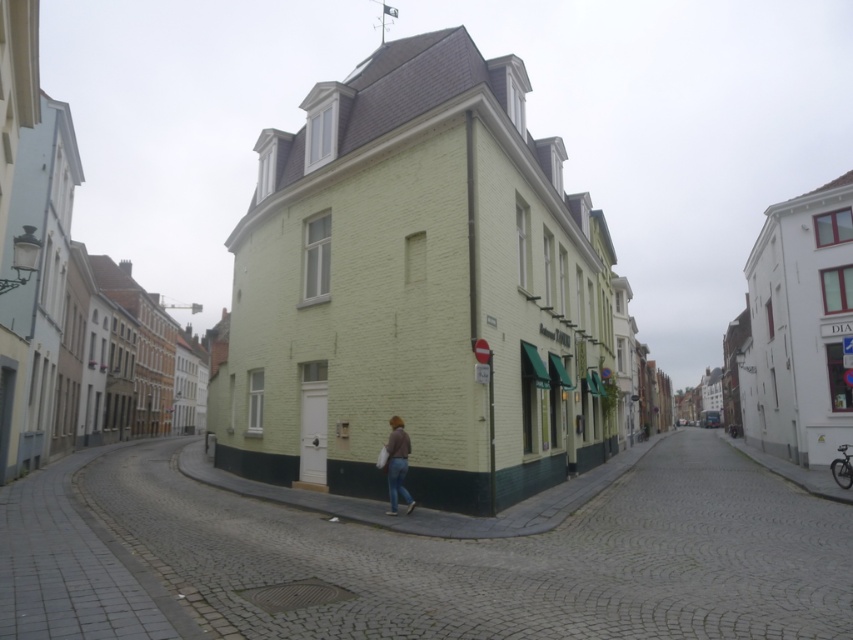
Question: Which point is closer to the camera taking this photo?

Choices:
 (A) (405, 497)
 (B) (759, 472)

Answer: (A)

Question: Observing the image, what is the correct spatial positioning of smooth cobblestone alley at center in reference to denim pants at center?

Choices:
 (A) right
 (B) left

Answer: (B)

Question: Is smooth cobblestone alley at center in front of denim pants at center?

Choices:
 (A) yes
 (B) no

Answer: (A)

Question: Which object is farther from the camera taking this photo?

Choices:
 (A) smooth cobblestone alley at center
 (B) denim pants at center

Answer: (B)

Question: Does smooth cobblestone alley at center come behind denim pants at center?

Choices:
 (A) yes
 (B) no

Answer: (B)

Question: Among these objects, which one is farthest from the camera?

Choices:
 (A) smooth cobblestone alley at center
 (B) denim pants at center

Answer: (B)